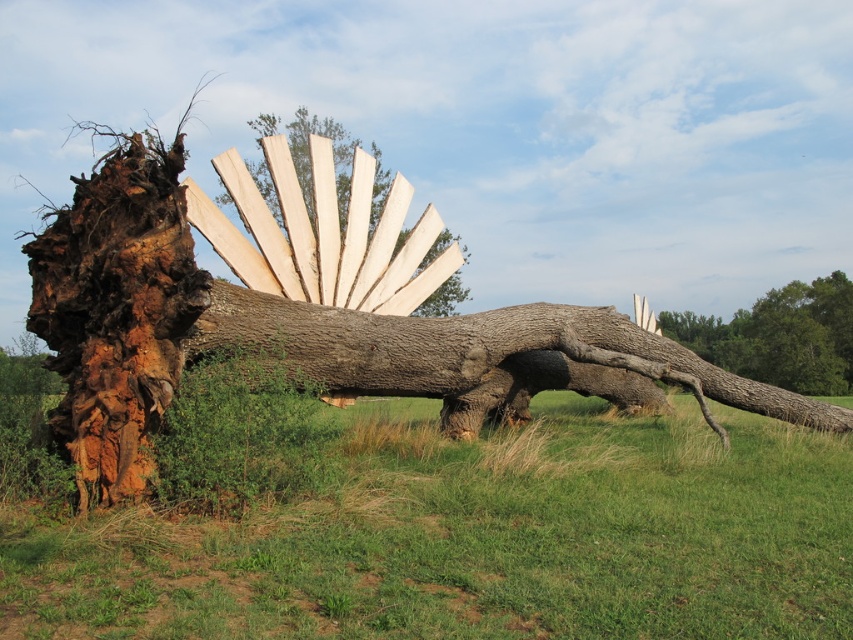
Is point (97, 333) more distant than point (807, 364)?

No, (97, 333) is closer to viewer.

Does rustic wood sculpture at left have a lesser height compared to smooth bark tree trunk at right?

No, rustic wood sculpture at left is not shorter than smooth bark tree trunk at right.

I want to click on rustic wood sculpture at left, so click(x=299, y=310).

Locate an element on the screen. This screenshot has height=640, width=853. rustic wood sculpture at left is located at coordinates (299, 310).

Which is more to the left, rustic wood sculpture at left or natural wood fan at center?

Positioned to the left is natural wood fan at center.

Describe the element at coordinates (299, 310) in the screenshot. The height and width of the screenshot is (640, 853). I see `rustic wood sculpture at left` at that location.

This screenshot has width=853, height=640. What are the coordinates of `rustic wood sculpture at left` in the screenshot? It's located at (299, 310).

What are the coordinates of `rustic wood sculpture at left` in the screenshot? It's located at (299, 310).

Which is below, green grass at lower left or natural wood fan at center?

green grass at lower left is lower down.

Which is more to the left, green grass at lower left or natural wood fan at center?

natural wood fan at center is more to the left.

Is point (802, 593) closer to viewer compared to point (299, 125)?

Yes.

You are a GUI agent. You are given a task and a screenshot of the screen. Output one action in this format:
    pyautogui.click(x=<x>, y=<y>)
    Task: Click on the green grass at lower left
    The height and width of the screenshot is (640, 853).
    Given the screenshot: What is the action you would take?
    pyautogui.click(x=477, y=538)